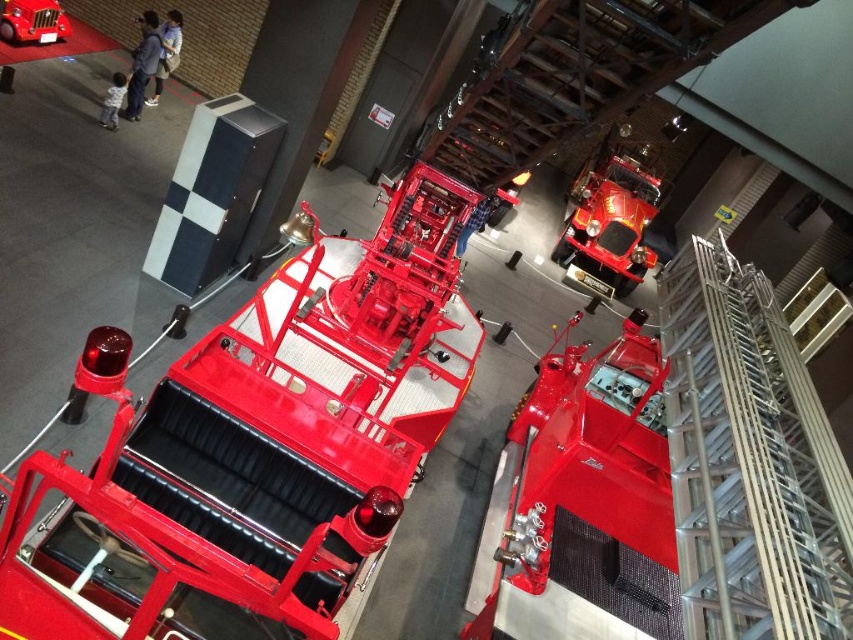
Question: Does glossy red fire truck at center have a lesser width compared to shiny red car at upper left?

Choices:
 (A) no
 (B) yes

Answer: (A)

Question: Which of the following is the farthest from the observer?

Choices:
 (A) (848, 593)
 (B) (647, 184)
 (C) (351, 564)

Answer: (B)

Question: Can you confirm if glossy metal fire truck at center is smaller than metallic silver ladder at center right?

Choices:
 (A) yes
 (B) no

Answer: (A)

Question: Which of the following is the farthest from the observer?

Choices:
 (A) glossy metal fire truck at center
 (B) glossy red fire truck at upper right
 (C) shiny red car at upper left
 (D) metallic silver ladder at center right

Answer: (B)

Question: Which object is the farthest from the glossy red fire truck at center?

Choices:
 (A) glossy red fire truck at upper right
 (B) glossy metal fire truck at center

Answer: (A)

Question: Does glossy red fire truck at upper right appear under shiny red car at upper left?

Choices:
 (A) yes
 (B) no

Answer: (A)